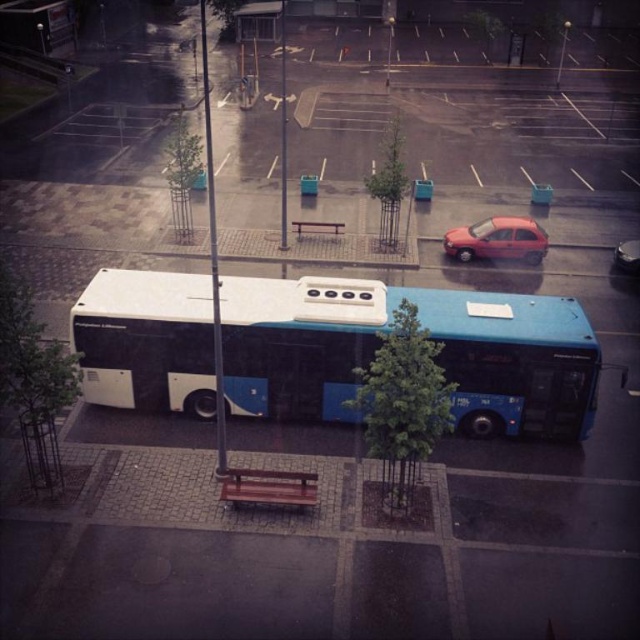
Does blue matte bus at center appear under brown wooden bench at center?

Yes.

Does blue matte bus at center appear over brown wooden bench at center?

No.

Does point (166, 381) come farther from viewer compared to point (300, 230)?

No, (166, 381) is in front of (300, 230).

At what (x,y) coordinates should I click in order to perform the action: click on blue matte bus at center. Please return your answer as a coordinate pair (x, y). Looking at the image, I should click on (429, 337).

Is blue matte bus at center taller than shiny red car at center right?

Correct, blue matte bus at center is much taller as shiny red car at center right.

Is blue matte bus at center to the left of shiny red car at center right from the viewer's perspective?

Correct, you'll find blue matte bus at center to the left of shiny red car at center right.

Is point (419, 298) behind point (524, 230)?

No.

The height and width of the screenshot is (640, 640). In order to click on blue matte bus at center in this screenshot , I will do `click(429, 337)`.

Does blue matte bus at center appear under wooden park bench at center?

No, blue matte bus at center is not below wooden park bench at center.

Does point (556, 316) come farther from viewer compared to point (228, 500)?

Yes, point (556, 316) is farther from viewer.

This screenshot has width=640, height=640. What do you see at coordinates (429, 337) in the screenshot?
I see `blue matte bus at center` at bounding box center [429, 337].

Find the location of a particular element. blue matte bus at center is located at coordinates (429, 337).